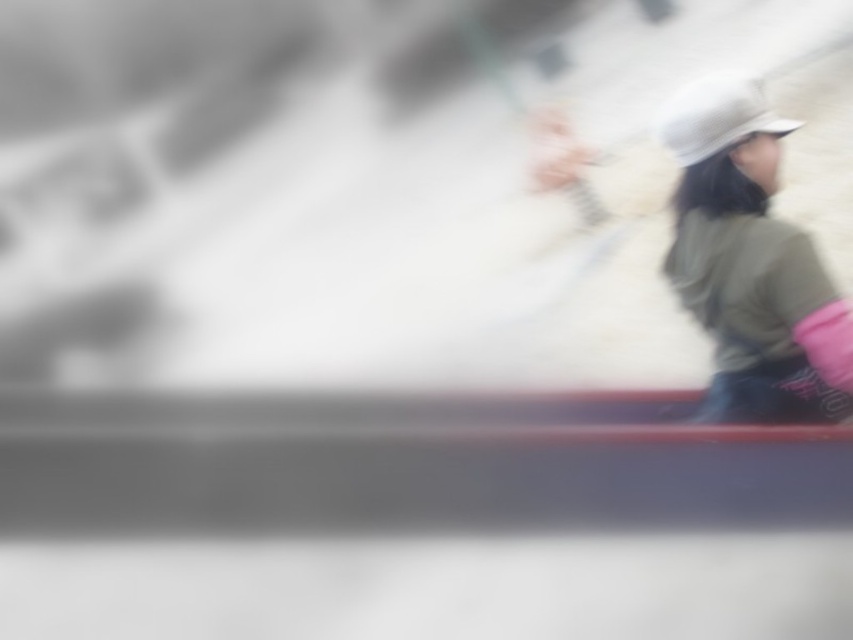
Does point (703, 250) come farther from viewer compared to point (692, 100)?

That is True.

The width and height of the screenshot is (853, 640). What do you see at coordinates (751, 264) in the screenshot?
I see `khaki cotton hat at right` at bounding box center [751, 264].

Locate an element on the screen. This screenshot has width=853, height=640. khaki cotton hat at right is located at coordinates (751, 264).

Where is `khaki cotton hat at right`? khaki cotton hat at right is located at coordinates (751, 264).